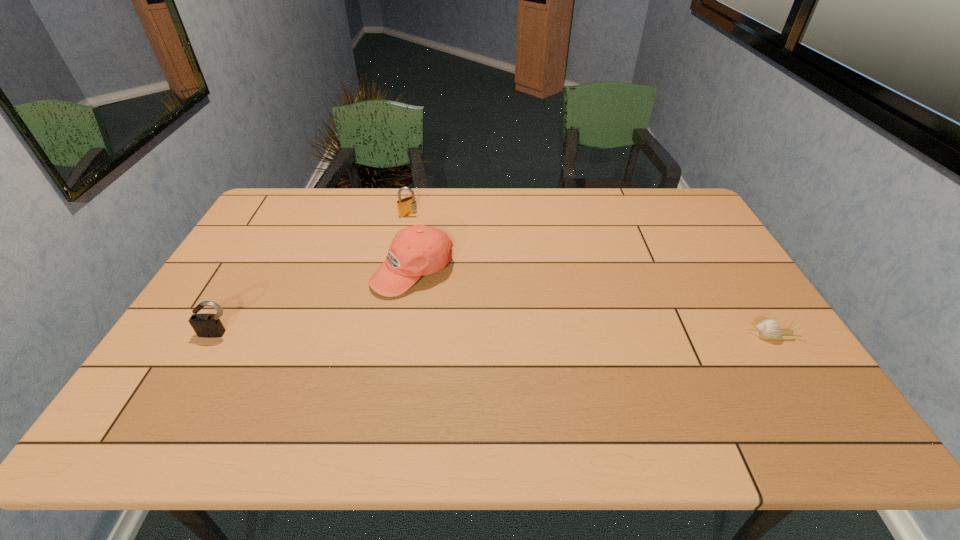
Where is `vacant space situated 0.220m on the shell of the escargot`? vacant space situated 0.220m on the shell of the escargot is located at coordinates (665, 335).

This screenshot has width=960, height=540. I want to click on free space located on the shell of the escargot, so click(x=654, y=335).

The height and width of the screenshot is (540, 960). I want to click on free spot located 0.350m on the side with the combination dials of the farther padlock, so click(470, 271).

At what (x,y) coordinates should I click in order to perform the action: click on vacant space located 0.150m on the side with the combination dials of the farther padlock. Please return your answer as a coordinate pair (x, y). Looking at the image, I should click on (436, 238).

This screenshot has width=960, height=540. I want to click on free spot located on the side with the combination dials of the farther padlock, so click(424, 228).

Identify the location of free space located 0.160m on the front-facing side of the baseball cap. (421, 342).

This screenshot has height=540, width=960. What are the coordinates of `free space located 0.320m on the front-facing side of the baseball cap` in the screenshot? It's located at (427, 396).

Where is `vacant position located 0.050m on the front-facing side of the baseball cap`? vacant position located 0.050m on the front-facing side of the baseball cap is located at coordinates pyautogui.click(x=418, y=312).

Identify the location of object situated at the far edge. pyautogui.click(x=407, y=206).

Where is `object that is at the left edge`? The image size is (960, 540). object that is at the left edge is located at coordinates (205, 325).